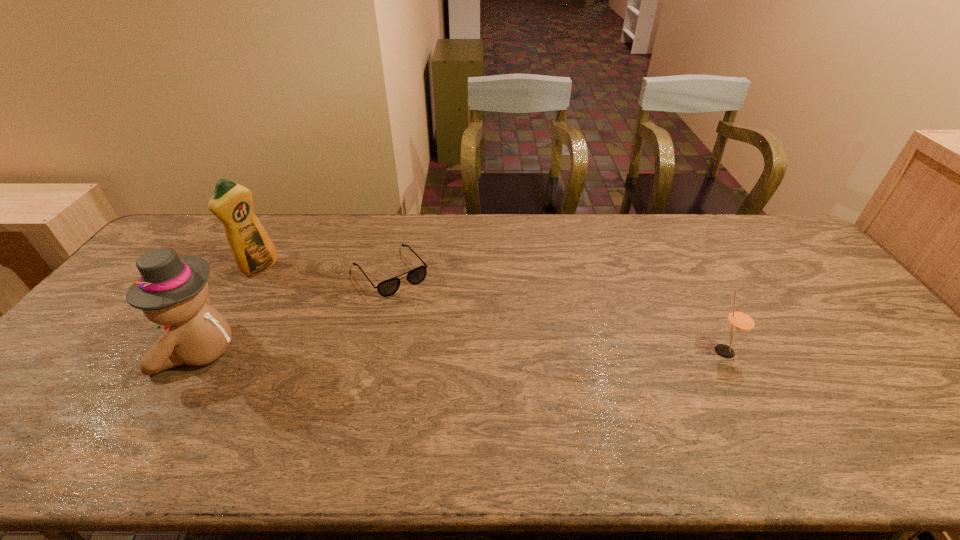
The image size is (960, 540). I want to click on free space that is in between the detergent and the second shortest object, so click(492, 309).

Find the location of a particular element. The width and height of the screenshot is (960, 540). free space that is in between the shortest object and the rag_doll is located at coordinates (296, 312).

Locate an element on the screen. The width and height of the screenshot is (960, 540). vacant area that lies between the rag_doll and the detergent is located at coordinates (230, 309).

Where is `the second closest object to the detergent`? Image resolution: width=960 pixels, height=540 pixels. the second closest object to the detergent is located at coordinates (388, 287).

Identify which object is the second nearest to the rag_doll. Please provide its 2D coordinates. Your answer should be formatted as a tuple, i.e. [(x, y)], where the tuple contains the x and y coordinates of a point satisfying the conditions above.

[(388, 287)]

Locate an element on the screen. This screenshot has height=540, width=960. vacant point that satisfies the following two spatial constraints: 1. on the front side of the spectacles; 2. on the left side of the second shortest object is located at coordinates (372, 351).